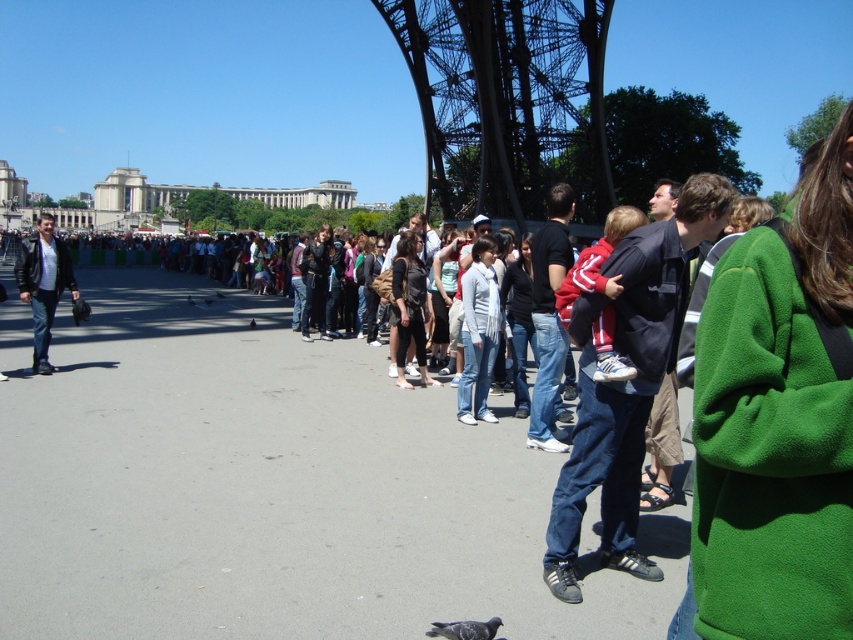
You are a photographer standing at the base of the Eiffel Tower. You want to capture a photo of both the green fleece jacket at center and the black leather jacket at left in the same frame. Given that your camera has a maximum zoom range of 200 feet, can you fit both jackets into the photo without moving your position?

The distance between the green fleece jacket at center and the black leather jacket at left is 380.68 feet. Since your camera can only zoom up to 200 feet, you cannot fit both jackets into the same frame without moving your position.

You are a photographer at the Eiffel Tower and want to take a photo of the gray matte pigeon at lower center without the green fleece jacket at center blocking it. How should you adjust your position?

Move your camera position backward to ensure the green fleece jacket at center is no longer in front of the gray matte pigeon at lower center.

You are standing at the base of the Eiffel Tower and notice a green fleece jacket at center and a metallic structure at center. Which object is positioned more to the right from your viewpoint?

The green fleece jacket at center is positioned to the right of the metallic structure at center, so it is more to the right.